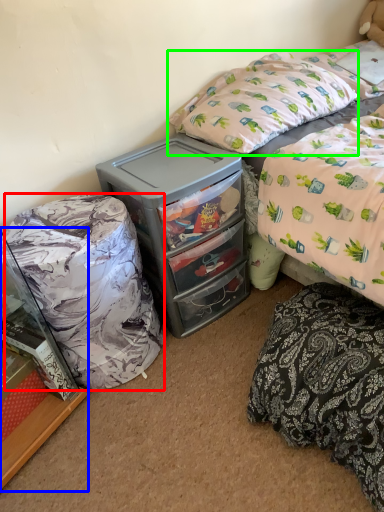
Question: Which object is the farthest from bean bag chair (highlighted by a red box)? Choose among these: cabinetry (highlighted by a blue box) or pillow (highlighted by a green box).

Choices:
 (A) cabinetry
 (B) pillow

Answer: (B)